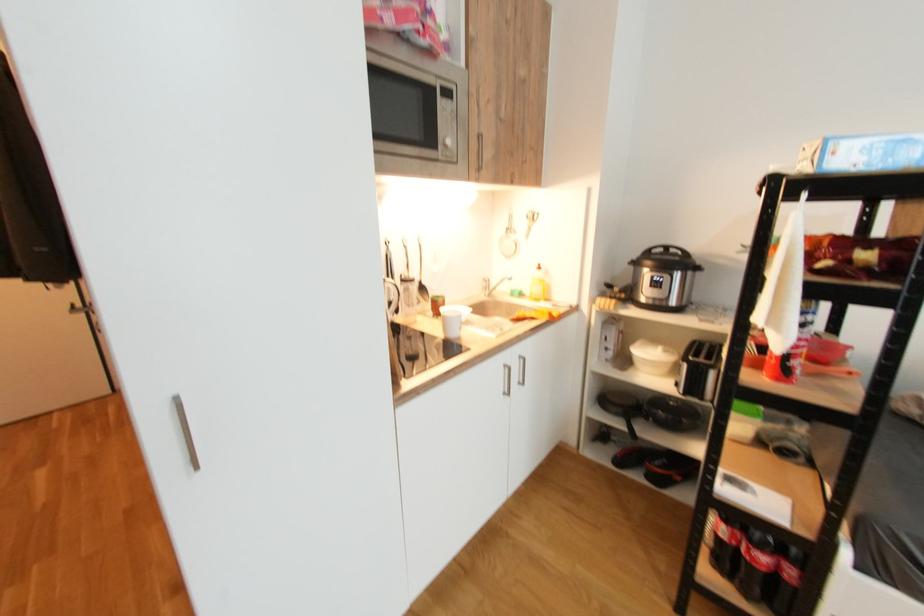
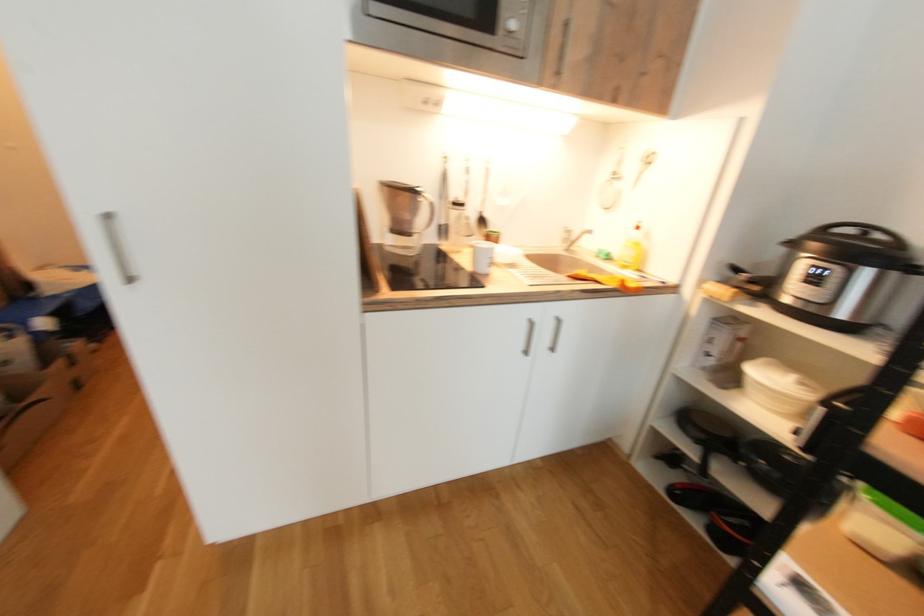
Question: The images are taken continuously from a first-person perspective. In which direction is your viewpoint rotating?

Choices:
 (A) Left
 (B) Right
 (C) Up
 (D) Down

Answer: (A)